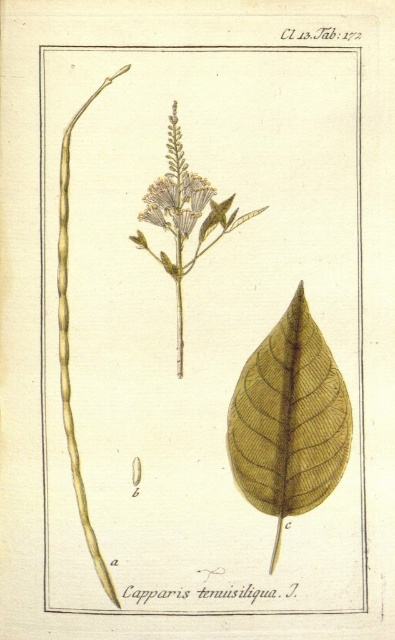
Question: Can you confirm if brown textured leaf at center is positioned to the right of matte white flower at center?

Choices:
 (A) no
 (B) yes

Answer: (B)

Question: Among these points, which one is nearest to the camera?

Choices:
 (A) (338, 460)
 (B) (182, 371)

Answer: (A)

Question: Can you confirm if brown textured leaf at center is smaller than light yellow textured flower at center?

Choices:
 (A) yes
 (B) no

Answer: (B)

Question: Among these objects, which one is farthest from the camera?

Choices:
 (A) brown textured leaf at center
 (B) light yellow textured flower at center

Answer: (B)

Question: Which object is the farthest from the light yellow textured flower at center?

Choices:
 (A) brown textured leaf at center
 (B) matte white flower at center

Answer: (A)

Question: Can you confirm if brown textured leaf at center is smaller than matte white flower at center?

Choices:
 (A) yes
 (B) no

Answer: (A)